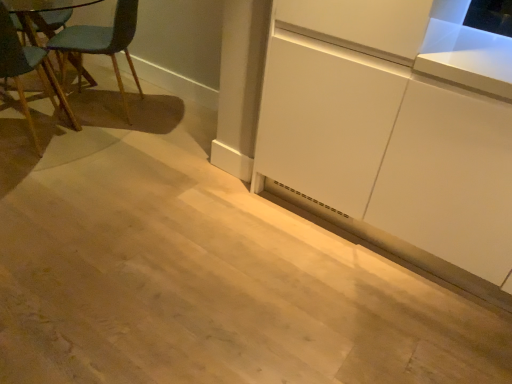
Locate an element on the screen. This screenshot has width=512, height=384. vacant space situated on the left part of white matte cabinet at lower right is located at coordinates (209, 198).